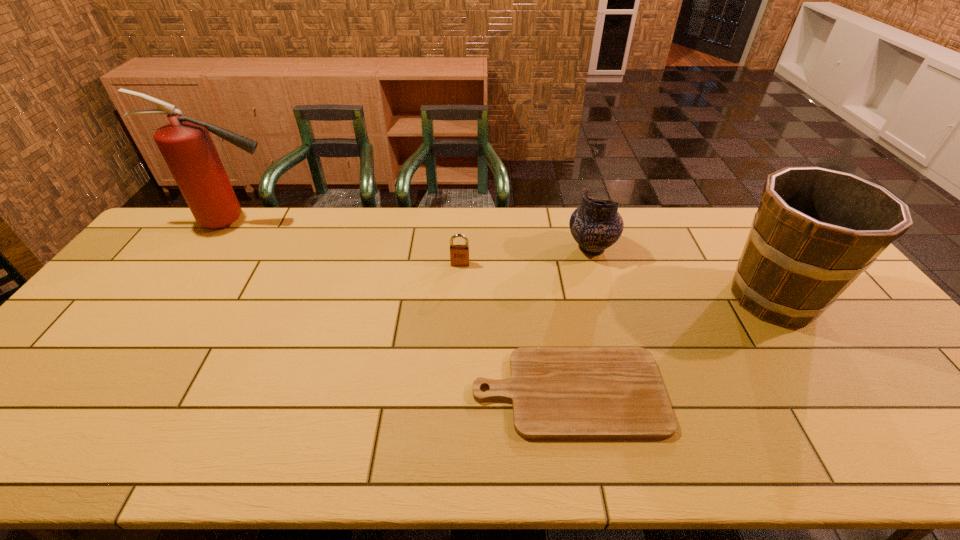
In the image, there is a desktop. Where is `vacant area at the far edge`? vacant area at the far edge is located at coordinates (208, 233).

Where is `vacant region at the near edge of the desktop`? This screenshot has width=960, height=540. vacant region at the near edge of the desktop is located at coordinates (286, 450).

Where is `free spot at the left edge of the desktop`? The image size is (960, 540). free spot at the left edge of the desktop is located at coordinates (131, 321).

Identify the location of free area in between the shortest object and the pottery. This screenshot has height=540, width=960. (580, 320).

This screenshot has width=960, height=540. In order to click on free space that is in between the fourth tallest object and the pottery in this screenshot , I will do `click(526, 256)`.

Identify the location of free space between the tallest object and the chopping board. Image resolution: width=960 pixels, height=540 pixels. (400, 307).

Identify the location of free point between the padlock and the tallest object. This screenshot has height=540, width=960. (347, 242).

I want to click on vacant area that lies between the third tallest object and the leftmost object, so click(412, 235).

Where is `vacant area between the rightmost object and the nearest object`? The height and width of the screenshot is (540, 960). vacant area between the rightmost object and the nearest object is located at coordinates (670, 345).

The image size is (960, 540). Find the location of `free space between the shortest object and the fire extinguisher`. free space between the shortest object and the fire extinguisher is located at coordinates (400, 307).